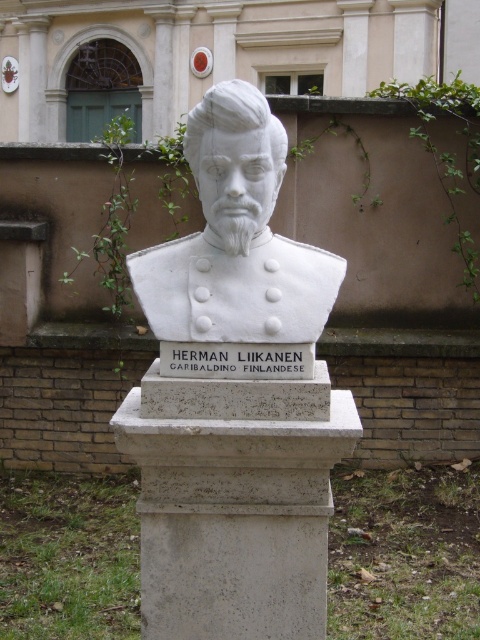
Question: Does white stone bust at center have a larger size compared to white stone sign at center?

Choices:
 (A) no
 (B) yes

Answer: (B)

Question: Which of the following is the closest to the observer?

Choices:
 (A) (259, 372)
 (B) (245, 204)
 (C) (190, 440)

Answer: (B)

Question: Does white marble bust at center appear on the left side of white stone bust at center?

Choices:
 (A) no
 (B) yes

Answer: (A)

Question: Can you confirm if white marble bust at center is bigger than white stone sign at center?

Choices:
 (A) no
 (B) yes

Answer: (B)

Question: Considering the real-world distances, which object is farthest from the white marble bust at center?

Choices:
 (A) white stone bust at center
 (B) white stone sign at center

Answer: (A)

Question: Which is nearer to the white marble bust at center?

Choices:
 (A) white stone bust at center
 (B) white stone sign at center

Answer: (B)